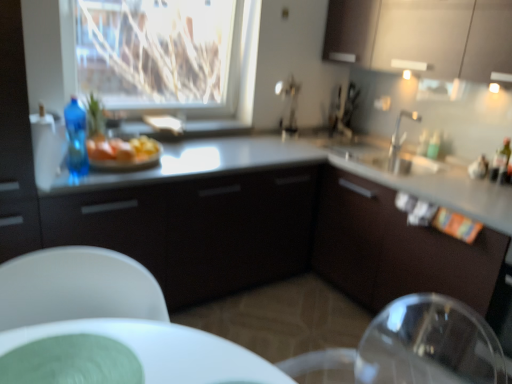
Where is `vacant area on the back side of yellow butter at center`? The width and height of the screenshot is (512, 384). vacant area on the back side of yellow butter at center is located at coordinates (174, 153).